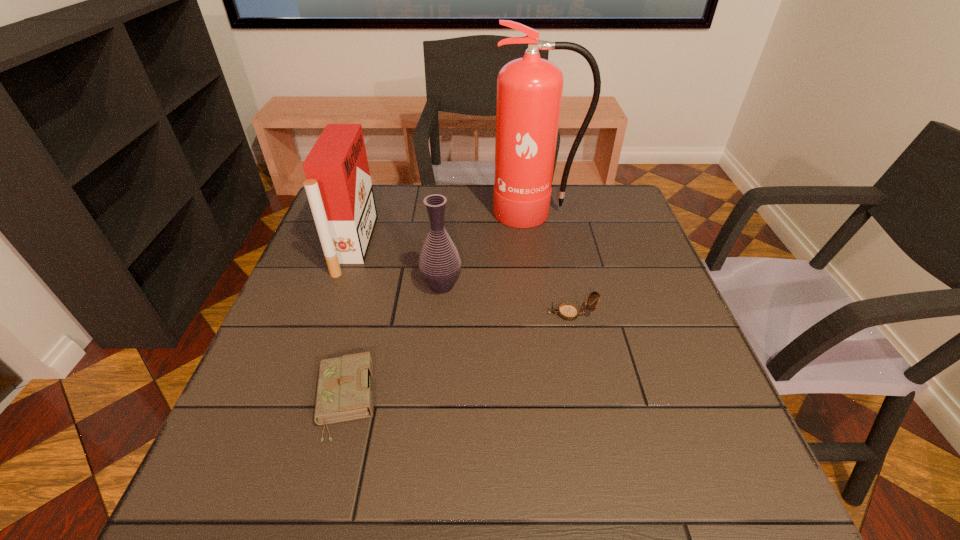
This screenshot has height=540, width=960. I want to click on free spot between the tallest object and the second shortest object, so pos(554,263).

The image size is (960, 540). What are the coordinates of `free area in between the tallest object and the shortest object` in the screenshot? It's located at (441, 306).

At what (x,y) coordinates should I click in order to perform the action: click on vacant region between the nearest object and the fire extinguisher. Please return your answer as a coordinate pair (x, y). This screenshot has width=960, height=540. Looking at the image, I should click on (441, 306).

You are a GUI agent. You are given a task and a screenshot of the screen. Output one action in this format:
    pyautogui.click(x=<x>, y=<y>)
    Task: Click on the free space that is in between the third object from left to right and the tallest object
    
    Given the screenshot: What is the action you would take?
    pyautogui.click(x=489, y=249)

Identify the location of vacant point located between the cigarette case and the compass. (463, 279).

You are a GUI agent. You are given a task and a screenshot of the screen. Output one action in this format:
    pyautogui.click(x=<x>, y=<y>)
    Task: Click on the free space between the cigarette case and the second nearest object
    
    Given the screenshot: What is the action you would take?
    463,279

The height and width of the screenshot is (540, 960). Identify the location of vacant region between the cigarette case and the fourth tallest object. click(463, 279).

Identify the location of object that stands as the second closest to the shortest object. (339, 189).

Locate an element on the screen. object that stands as the second closest to the compass is located at coordinates (529, 90).

At what (x,y) coordinates should I click in order to perform the action: click on free space that satisfies the following two spatial constraints: 1. on the front-facing side of the shortest object; 2. on the right side of the cigarette case. Please return your answer as a coordinate pair (x, y). Looking at the image, I should click on (300, 400).